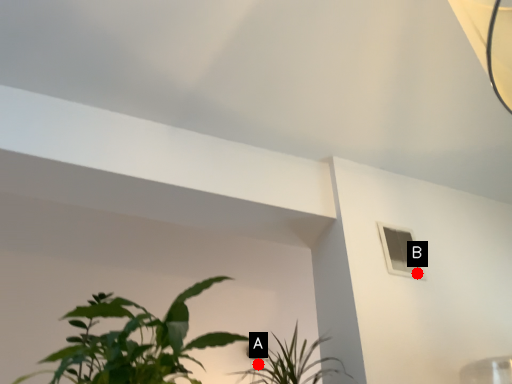
Question: Two points are circled on the image, labeled by A and B beside each circle. Which of the following is the farthest from the observer?

Choices:
 (A) A is further
 (B) B is further

Answer: (A)